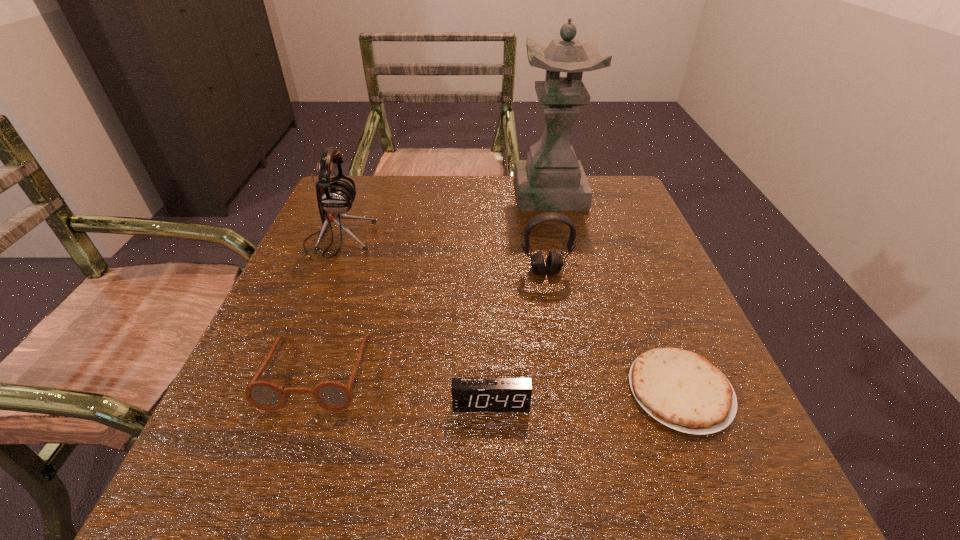
Locate an element on the screen. sculpture is located at coordinates (551, 179).

Locate an element on the screen. Image resolution: width=960 pixels, height=540 pixels. the farthest object is located at coordinates (551, 179).

Find the location of a particular element. the second tallest object is located at coordinates (335, 195).

Image resolution: width=960 pixels, height=540 pixels. In order to click on earphone in this screenshot , I will do `click(335, 195)`.

You are a GUI agent. You are given a task and a screenshot of the screen. Output one action in this format:
    pyautogui.click(x=<x>, y=<y>)
    Task: Click on the headset
    The height and width of the screenshot is (540, 960).
    Given the screenshot: What is the action you would take?
    pyautogui.click(x=554, y=263)

You are a GUI agent. You are given a task and a screenshot of the screen. Output one action in this format:
    pyautogui.click(x=<x>, y=<y>)
    Task: Click on the third farthest object
    Image resolution: width=960 pixels, height=540 pixels.
    Given the screenshot: What is the action you would take?
    pyautogui.click(x=554, y=263)

Where is `alarm clock`? The width and height of the screenshot is (960, 540). alarm clock is located at coordinates (468, 394).

In order to click on spectacles in this screenshot , I will do `click(331, 395)`.

Where is `tortilla`? tortilla is located at coordinates (683, 390).

Find the location of `free spot located 0.170m at the front opening of the sculpture`. free spot located 0.170m at the front opening of the sculpture is located at coordinates point(453,193).